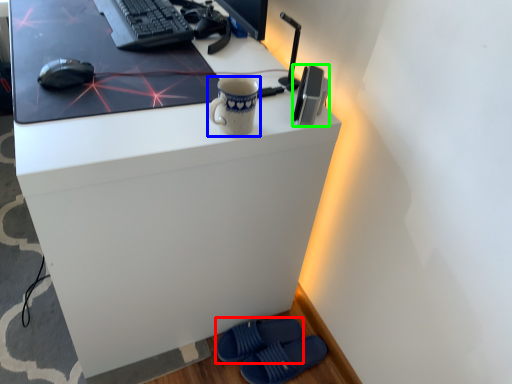
Question: Which object is positioned farthest from footwear (highlighted by a red box)? Select from mug (highlighted by a blue box) and gadget (highlighted by a green box).

Choices:
 (A) mug
 (B) gadget

Answer: (B)